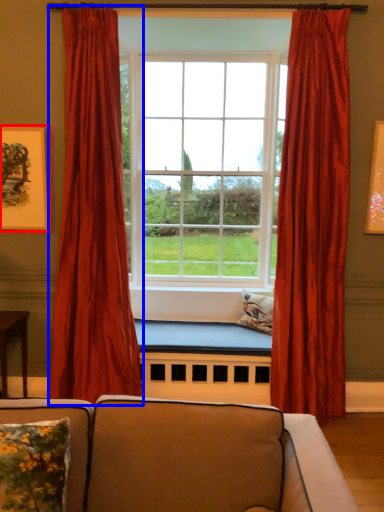
Question: Which point is closer to the camera, picture frame (highlighted by a red box) or curtain (highlighted by a blue box)?

Choices:
 (A) picture frame
 (B) curtain

Answer: (B)